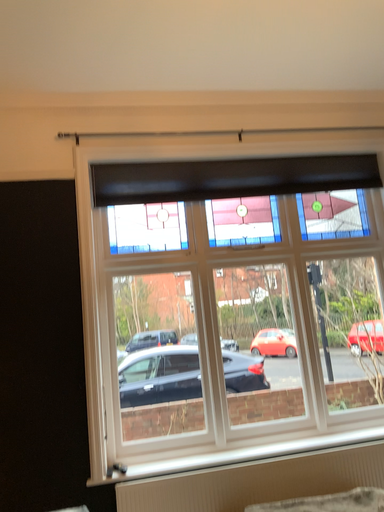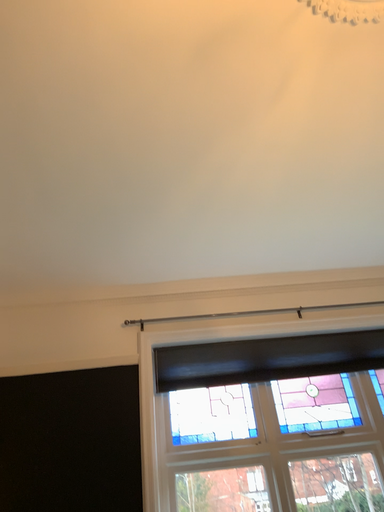
Question: How did the camera likely rotate when shooting the video?

Choices:
 (A) rotated right
 (B) rotated left

Answer: (B)